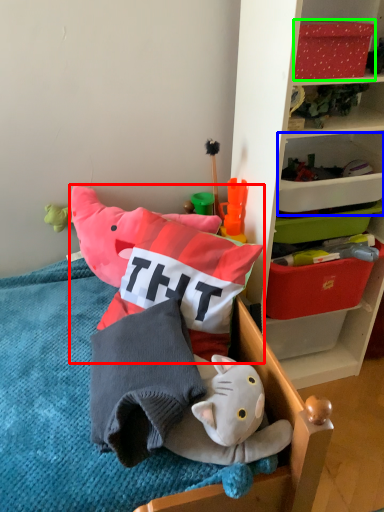
Question: Which object is the farthest from toy (highlighted by a red box)? Choose among these: storage box (highlighted by a blue box) or storage box (highlighted by a green box).

Choices:
 (A) storage box
 (B) storage box

Answer: (B)